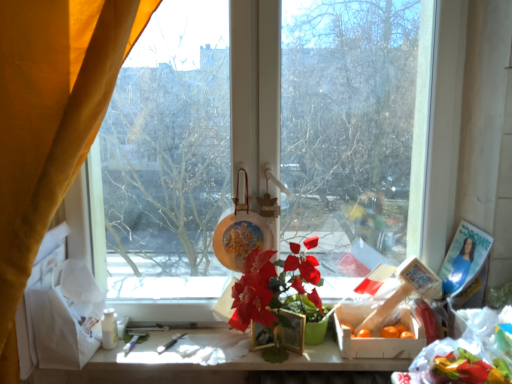
Question: In the image, is wooden crate of oranges at center on the left side or the right side of matte plastic flower at center?

Choices:
 (A) left
 (B) right

Answer: (B)

Question: Considering the positions of point (350, 317) and point (298, 259), is point (350, 317) closer or farther from the camera than point (298, 259)?

Choices:
 (A) closer
 (B) farther

Answer: (B)

Question: Which object is the farthest from the white matte table at center?

Choices:
 (A) wooden crate of oranges at center
 (B) velvet yellow curtain at left
 (C) transparent glass window at center
 (D) matte plastic flower at center

Answer: (B)

Question: Which is nearer to the transparent glass window at center?

Choices:
 (A) matte plastic flower at center
 (B) velvet yellow curtain at left
 (C) white matte table at center
 (D) wooden crate of oranges at center

Answer: (A)